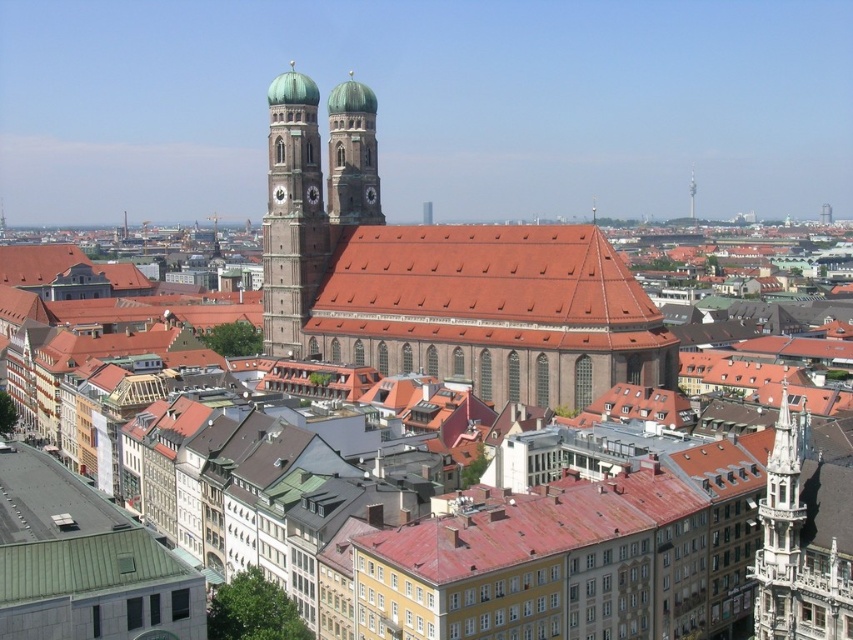
Is matte brown clock tower at center-left bigger than shiny silver spire at upper center?

Yes, matte brown clock tower at center-left is bigger than shiny silver spire at upper center.

Is point (305, 145) positioned after point (693, 170)?

That is False.

What do you see at coordinates (292, 212) in the screenshot? I see `matte brown clock tower at center-left` at bounding box center [292, 212].

The height and width of the screenshot is (640, 853). I want to click on matte brown clock tower at center-left, so click(x=292, y=212).

Who is lower down, matte brown clock tower at center-left or matte gray clock at center?

Positioned lower is matte brown clock tower at center-left.

Who is taller, matte brown clock tower at center-left or matte gray clock at center?

With more height is matte brown clock tower at center-left.

Who is more forward, (273, 296) or (283, 195)?

Point (283, 195) is more forward.

Where is `matte brown clock tower at center-left`? This screenshot has width=853, height=640. matte brown clock tower at center-left is located at coordinates (292, 212).

Which is behind, point (36, 570) or point (689, 204)?

The point (689, 204) is more distant.

Is point (141, 528) closer to camera compared to point (695, 184)?

Yes, it is.

Identify the location of green metal roof at lower left. (83, 564).